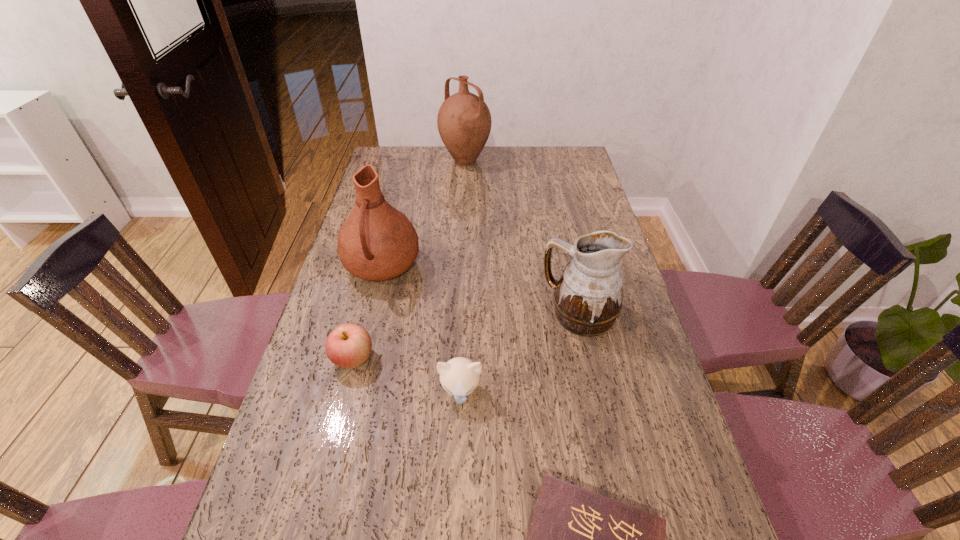
At what (x,y) coordinates should I click in order to perform the action: click on vacant space at the far right corner of the desktop. Please return your answer as a coordinate pair (x, y). This screenshot has width=960, height=540. Looking at the image, I should click on (567, 147).

At what (x,y) coordinates should I click in order to perform the action: click on free point between the apple and the kitten. Please return your answer as a coordinate pair (x, y). The image size is (960, 540). Looking at the image, I should click on (407, 375).

The width and height of the screenshot is (960, 540). Identify the location of vacant region between the rightmost pitcher and the leftmost pitcher. (481, 291).

Where is `free spot between the leftmost pitcher and the kitten`? free spot between the leftmost pitcher and the kitten is located at coordinates 421,329.

This screenshot has height=540, width=960. I want to click on free area in between the apple and the rightmost pitcher, so click(x=467, y=336).

Locate an element on the screen. The width and height of the screenshot is (960, 540). vacant area between the rightmost pitcher and the leftmost pitcher is located at coordinates (481, 291).

Identify the location of vacant region between the second pitcher from left to right and the rightmost pitcher. (522, 238).

Locate an element on the screen. vacant space in between the rightmost pitcher and the kitten is located at coordinates (520, 353).

Choose which object is the fourth nearest neighbor to the kitten. Please provide its 2D coordinates. Your answer should be formatted as a tuple, i.e. [(x, y)], where the tuple contains the x and y coordinates of a point satisfying the conditions above.

[(376, 242)]

Point out which object is positioned as the fifth nearest to the hardback book. Please provide its 2D coordinates. Your answer should be formatted as a tuple, i.e. [(x, y)], where the tuple contains the x and y coordinates of a point satisfying the conditions above.

[(464, 122)]